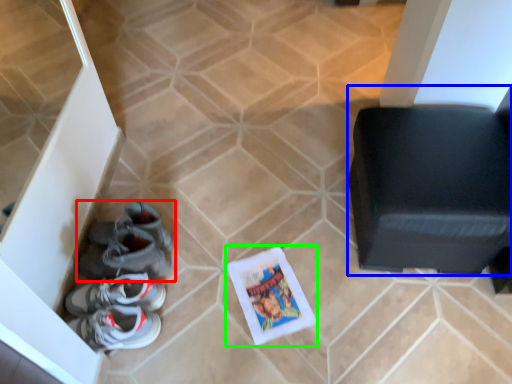
Question: Based on their relative distances, which object is nearer to footwear (highlighted by a red box)? Choose from furniture (highlighted by a blue box) and comic book (highlighted by a green box).

Choices:
 (A) furniture
 (B) comic book

Answer: (B)